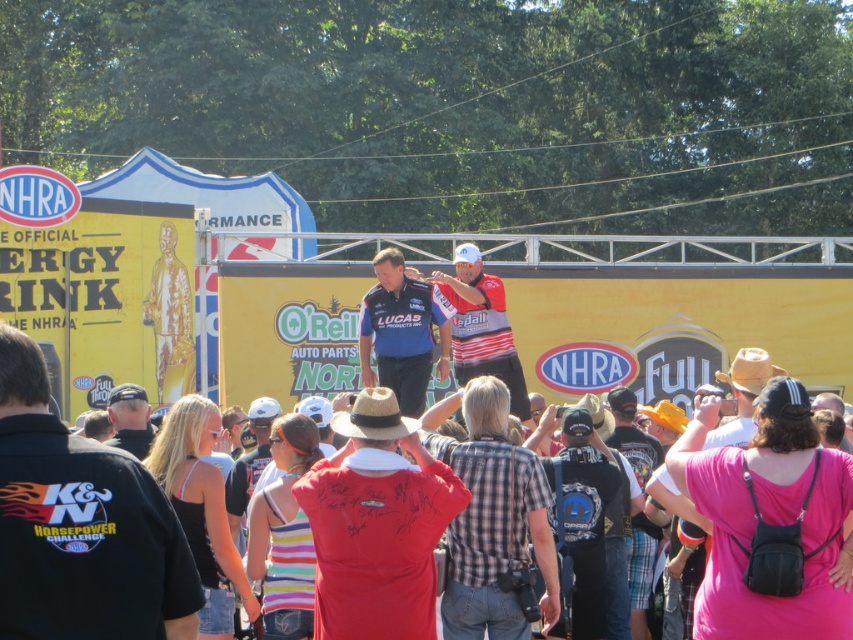
You are standing at the event and want to reach the point marked as point (387, 310). If you walk straight ahead, how far will you have to go to reach it?

The point (387, 310) is 51.06 meters away from the viewer, so you will have to walk 51.06 meters straight ahead to reach it.

You are attending the event and want to find the blue jersey at center. According to the coordinates provided, where should you look relative to the center of the image?

The blue jersey at center is exactly at the center of the image since its coordinates are approximately 0.5 in both x and y values.

You are at the NHRA event and see two people in the center of the image wearing a blue jersey at center and a striped jersey at center. Which one is positioned more to the left?

The blue jersey at center is positioned to the left of the striped jersey at center, so the blue jersey at center is more to the left.